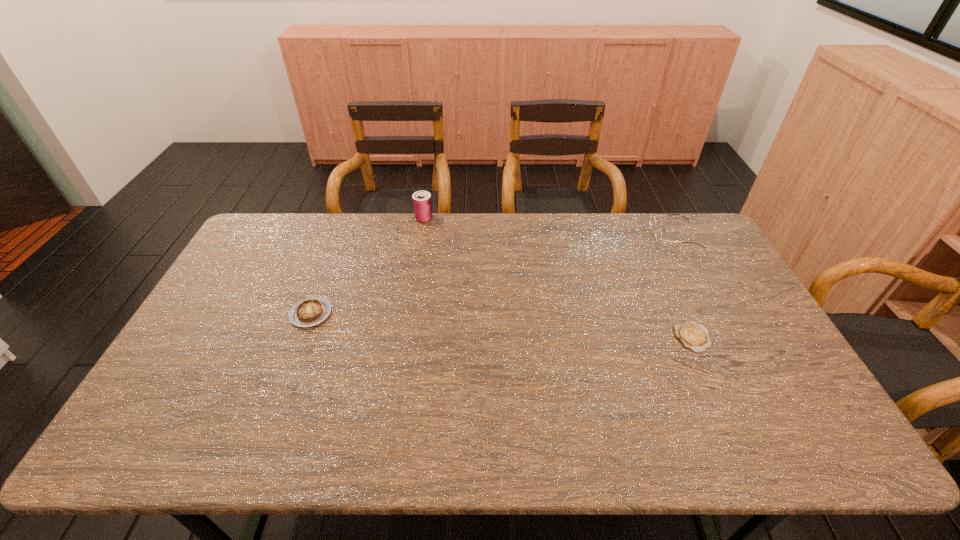
Find the location of `the tallest object`. the tallest object is located at coordinates (x=422, y=204).

The width and height of the screenshot is (960, 540). I want to click on the third object from right to left, so click(x=422, y=204).

Find the location of a particular element. The width and height of the screenshot is (960, 540). spectacles is located at coordinates (658, 234).

The width and height of the screenshot is (960, 540). What are the coordinates of `the taller quiche` in the screenshot? It's located at (311, 311).

I want to click on the left quiche, so click(311, 311).

Where is `the right quiche`? Image resolution: width=960 pixels, height=540 pixels. the right quiche is located at coordinates (693, 336).

Where is `the shorter quiche`? The width and height of the screenshot is (960, 540). the shorter quiche is located at coordinates (693, 336).

Locate an element on the screen. This screenshot has height=540, width=960. vacant area located 0.250m on the left of the tallest object is located at coordinates (348, 218).

Identify the location of free point located 0.170m through the lenses of the third shortest object. This screenshot has width=960, height=540. (606, 234).

I want to click on vacant space located through the lenses of the third shortest object, so click(x=613, y=234).